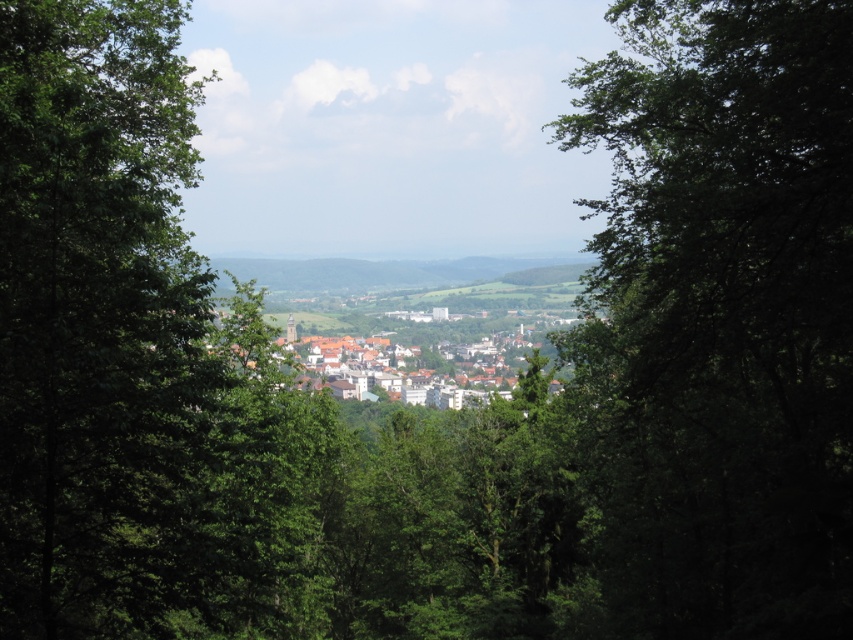
In the scene shown: You are a drone operator trying to capture a photo of the white matte buildings at center. Your drone has a camera with a 20cm wide lens. Considering the green leafy tree at center is blocking the view, can the drone fly through the gap between the tree and the buildings?

The green leafy tree at center has a lesser width compared to white matte buildings at center. Since the tree is narrower than the buildings, there might be enough space between them for the drone to pass through. However, the exact feasibility depends on the specific dimensions of the gap, which aren not provided here.

In the scene shown: You are a drone operator trying to capture a photo of the white matte buildings at center from above. The green leafy tree at left might block your view. Based on their sizes, which object would you need to adjust your camera angle to avoid?

The green leafy tree at left is larger in size than the white matte buildings at center, so you would need to adjust your camera angle to avoid the green leafy tree at left.